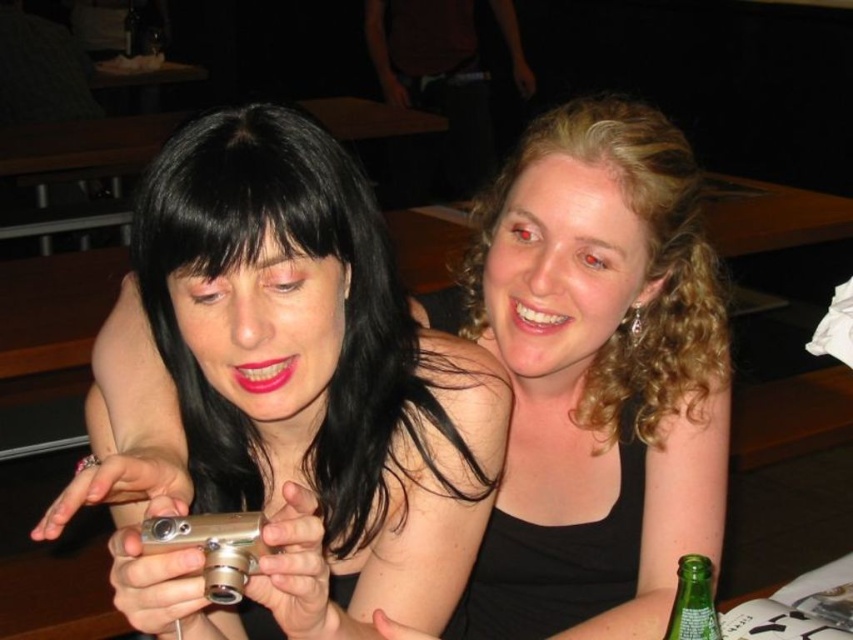
Is matte silver camera at center wider than green glass bottle at lower right?

Yes.

How far apart are matte silver camera at center and green glass bottle at lower right?

They are 14.82 inches apart.

Does point (585, 266) come farther from viewer compared to point (700, 564)?

Yes, point (585, 266) is behind point (700, 564).

Identify the location of matte silver camera at center. (596, 376).